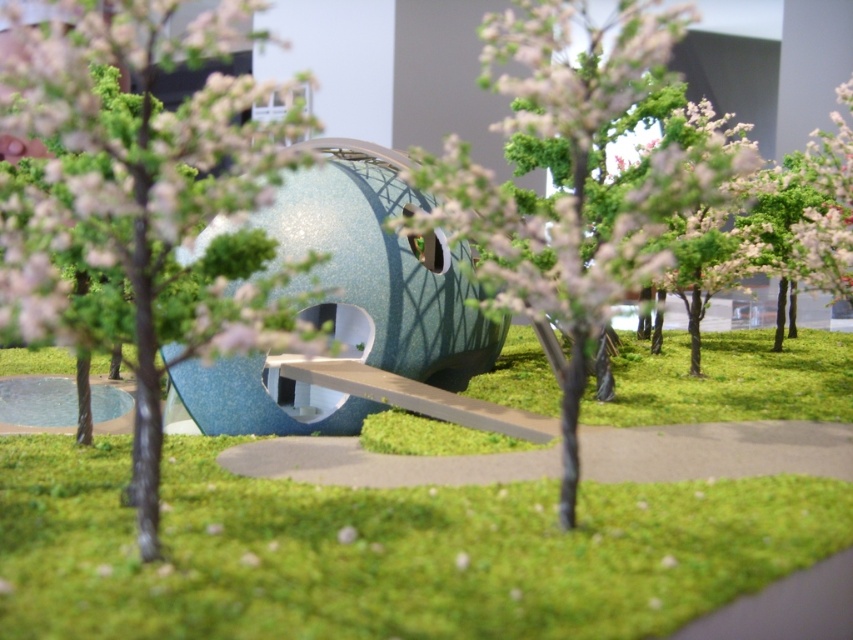
Based on the photo, you are designing a garden layout and want to place a new decorative stone. Which area has more space available between the green grass at center and the green matte tree at center?

The green matte tree at center occupies more space than the green grass at center, so there is more space available around the green matte tree at center.